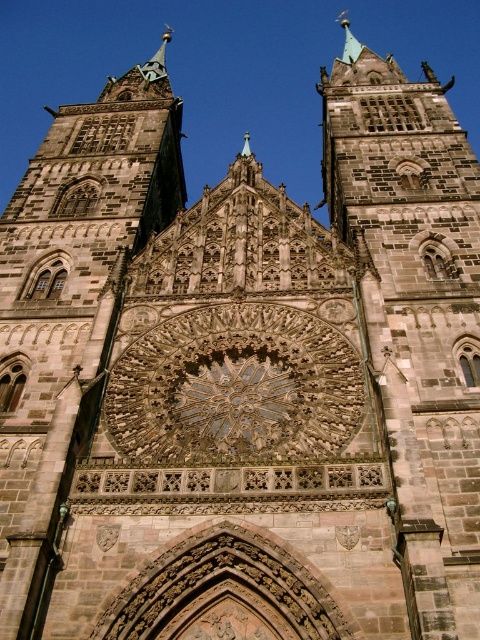
Question: Does dark stone tower at center have a lesser width compared to brown stone tower at center?

Choices:
 (A) no
 (B) yes

Answer: (A)

Question: Which of the following is the farthest from the observer?

Choices:
 (A) (14, 428)
 (B) (422, 572)

Answer: (A)

Question: Considering the relative positions of dark stone tower at center and brown stone tower at center in the image provided, where is dark stone tower at center located with respect to brown stone tower at center?

Choices:
 (A) below
 (B) above

Answer: (A)

Question: In this image, where is dark stone tower at center located relative to brown stone tower at center?

Choices:
 (A) below
 (B) above

Answer: (A)